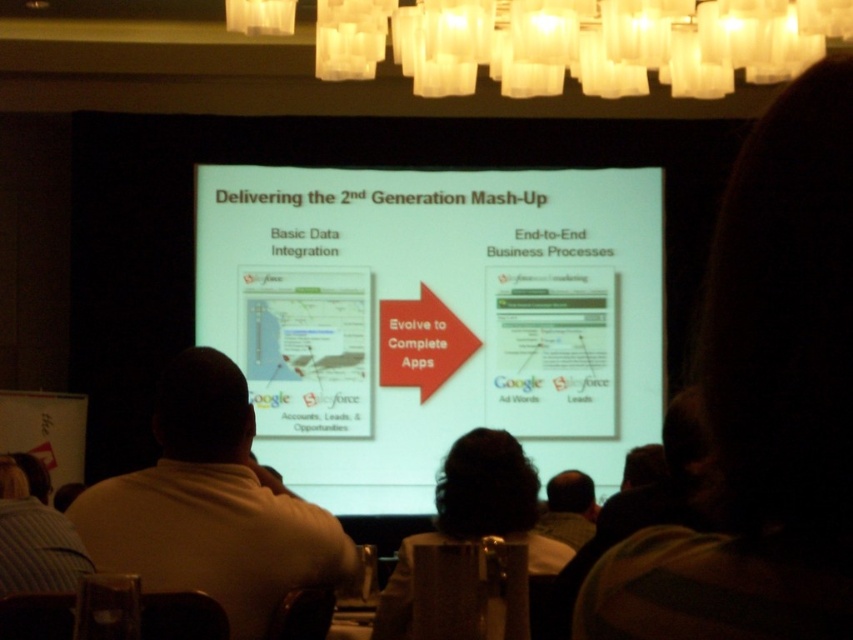
You are an event planner setting up a conference room with the white matte projector screen at center and the translucent glass chandelier at upper center. If you want to hang a banner that will not block the screen, where should you place it?

The white matte projector screen at center is much taller than the translucent glass chandelier at upper center, so placing the banner above the screen near the chandelier would avoid blocking it.

In the scene shown: You are a speaker standing at the front of the room. You want to adjust the position of the white matte projector screen at center so that it is closer to your white shirt at center. How much distance do you need to move it?

The white matte projector screen at center is currently 4.16 meters away from the white shirt at center. To move it closer, you need to reduce this distance by the desired amount.

You are an interior designer inspecting the lighting in the conference room. You notice a point at coordinates (578, 42). What object is located at this point?

The point at coordinates (578, 42) marks the translucent glass chandelier at upper center.